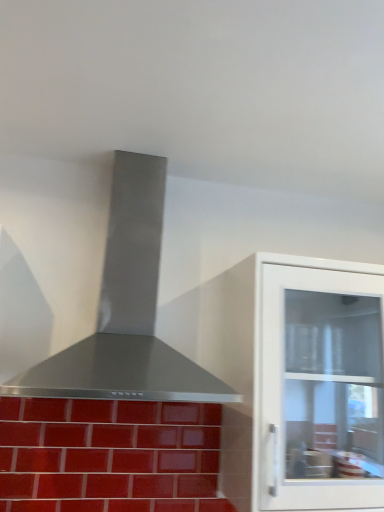
Question: From their relative heights in the image, would you say glossy ceramic tiles at lower left is taller or shorter than stainless steel vent at center?

Choices:
 (A) tall
 (B) short

Answer: (B)

Question: Relative to stainless steel vent at center, is glossy ceramic tiles at lower left in front or behind?

Choices:
 (A) front
 (B) behind

Answer: (B)

Question: Which of these objects is positioned farthest from the white glossy cabinet at right?

Choices:
 (A) glossy ceramic tiles at lower left
 (B) stainless steel vent at center

Answer: (B)

Question: Which of these objects is positioned farthest from the white glossy cabinet at right?

Choices:
 (A) stainless steel vent at center
 (B) glossy ceramic tiles at lower left

Answer: (A)